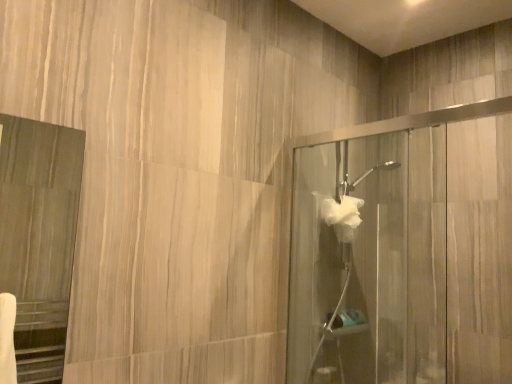
Question: Is white fluffy hand towel at center-right thinner than clear glass shower door at right, which is the 1th screen door in back-to-front order?

Choices:
 (A) no
 (B) yes

Answer: (B)

Question: Is white fluffy hand towel at center-right smaller than clear glass shower door at right, the 2th screen door positioned from the left?

Choices:
 (A) yes
 (B) no

Answer: (A)

Question: From a real-world perspective, is white fluffy hand towel at center-right over clear glass shower door at right, the 1th screen door in the right-to-left sequence?

Choices:
 (A) yes
 (B) no

Answer: (A)

Question: Is white fluffy hand towel at center-right located outside clear glass shower door at right, acting as the second screen door starting from the front?

Choices:
 (A) no
 (B) yes

Answer: (A)

Question: Is white fluffy hand towel at center-right facing towards clear glass shower door at right, acting as the second screen door starting from the front?

Choices:
 (A) yes
 (B) no

Answer: (A)

Question: From a real-world perspective, is matte wood mirror at left, which is the 1th screen door in front-to-back order, above or below clear glass shower door at right, the 2th screen door positioned from the left?

Choices:
 (A) above
 (B) below

Answer: (A)

Question: From the image's perspective, is matte wood mirror at left, placed as the second screen door when sorted from back to front, above or below clear glass shower door at right, acting as the second screen door starting from the front?

Choices:
 (A) below
 (B) above

Answer: (B)

Question: From their relative heights in the image, would you say matte wood mirror at left, which is the 2th screen door from right to left, is taller or shorter than clear glass shower door at right, the 2th screen door positioned from the left?

Choices:
 (A) short
 (B) tall

Answer: (A)

Question: Would you say matte wood mirror at left, which is the 1th screen door in front-to-back order, is inside or outside clear glass shower door at right, which is the 1th screen door in back-to-front order?

Choices:
 (A) inside
 (B) outside

Answer: (B)

Question: Is white fluffy hand towel at center-right to the left or to the right of clear glass shower door at right, the 1th screen door in the right-to-left sequence, in the image?

Choices:
 (A) right
 (B) left

Answer: (B)

Question: Considering the positions of point (344, 216) and point (302, 362), is point (344, 216) closer or farther from the camera than point (302, 362)?

Choices:
 (A) farther
 (B) closer

Answer: (A)

Question: From the image's perspective, is white fluffy hand towel at center-right above or below clear glass shower door at right, which is the 1th screen door in back-to-front order?

Choices:
 (A) below
 (B) above

Answer: (B)

Question: Is white fluffy hand towel at center-right wider or thinner than clear glass shower door at right, the 2th screen door positioned from the left?

Choices:
 (A) thin
 (B) wide

Answer: (A)

Question: Looking at their shapes, would you say clear glass shower door at right, the 1th screen door in the right-to-left sequence, is wider or thinner than white fluffy hand towel at center-right?

Choices:
 (A) wide
 (B) thin

Answer: (A)

Question: From the image's perspective, is clear glass shower door at right, the 2th screen door positioned from the left, positioned above or below white fluffy hand towel at center-right?

Choices:
 (A) above
 (B) below

Answer: (B)